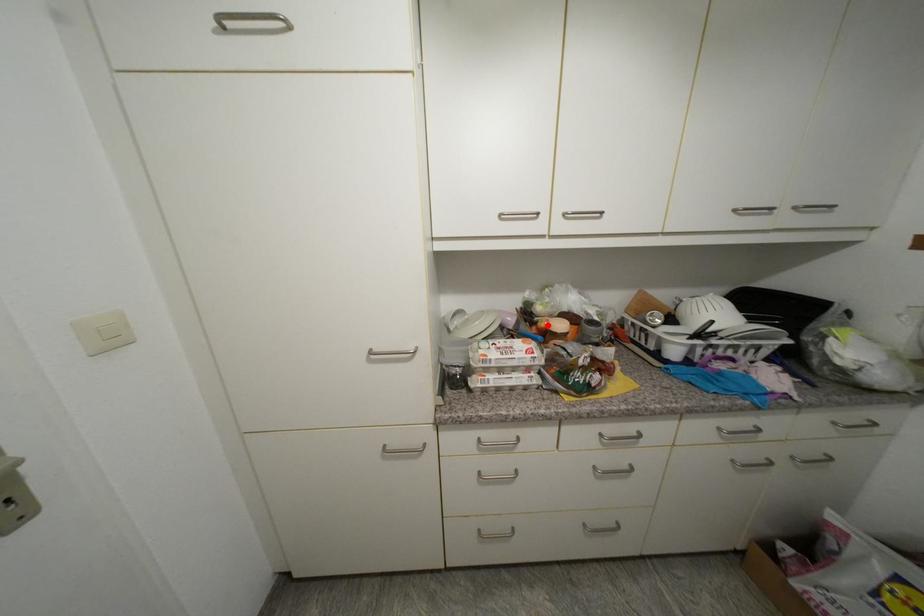
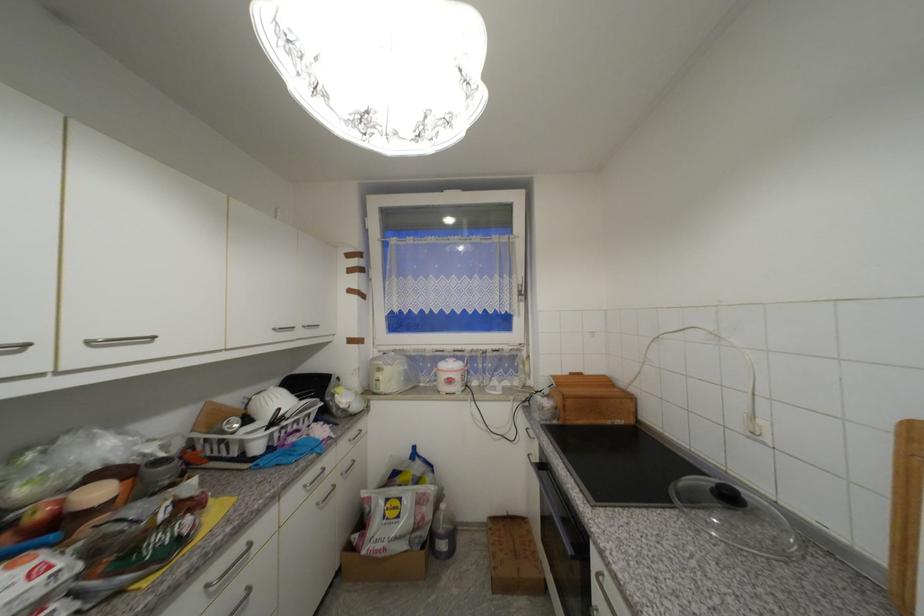
In the second image, find the point that corresponds to the highlighted location in the first image.

(44, 517)